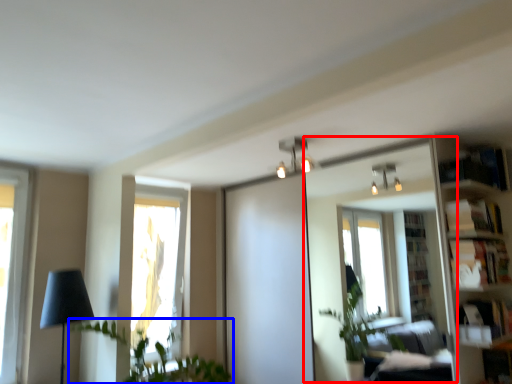
Question: Among these objects, which one is nearest to the camera, mirror (highlighted by a red box) or houseplant (highlighted by a blue box)?

Choices:
 (A) mirror
 (B) houseplant

Answer: (B)